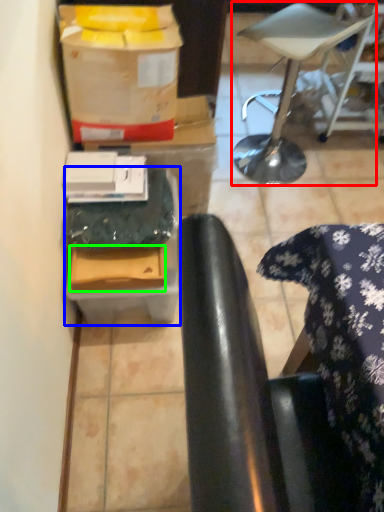
Question: Which object is the farthest from furniture (highlighted by a red box)? Choose among these: cardboard box (highlighted by a blue box) or cardboard box (highlighted by a green box).

Choices:
 (A) cardboard box
 (B) cardboard box

Answer: (B)